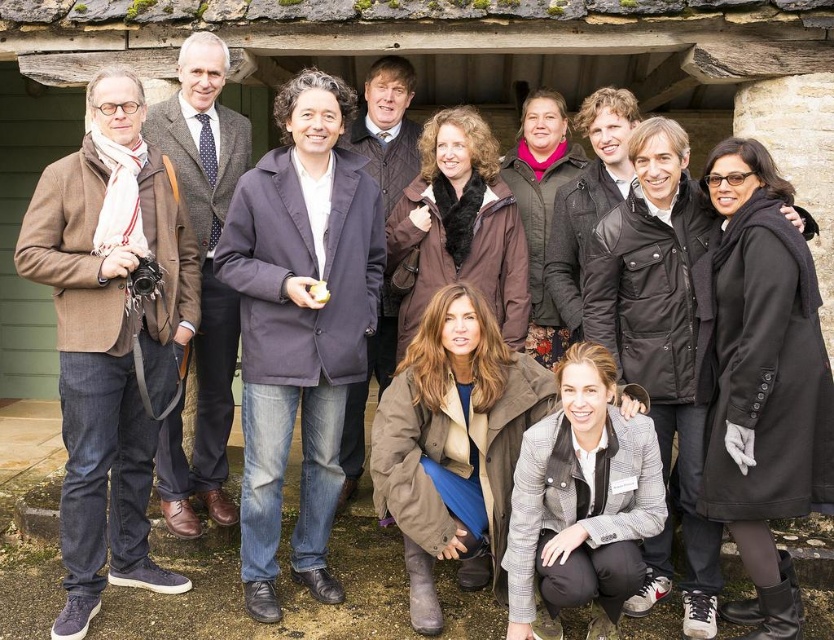
You are a GUI agent. You are given a task and a screenshot of the screen. Output one action in this format:
    pyautogui.click(x=<x>, y=<y>)
    Task: Click on the black wool coat at center-right
    
    Given the screenshot: What is the action you would take?
    pyautogui.click(x=761, y=380)

Is point (731, 429) more distant than point (186, 465)?

No.

Locate an element on the screen. black wool coat at center-right is located at coordinates (761, 380).

Between point (113, 346) and point (295, 193), which one is positioned in front?

Point (113, 346)

Measure the distance between point [143,566] and camera.

A distance of 10.25 meters exists between point [143,566] and camera.

What are the coordinates of `brown woolen jacket at left` in the screenshot? It's located at (109, 337).

Can you confirm if brown woolen jacket at left is thinner than black wool coat at center-right?

No, brown woolen jacket at left is not thinner than black wool coat at center-right.

Describe the element at coordinates (109, 337) in the screenshot. I see `brown woolen jacket at left` at that location.

Find the location of a particular element. brown woolen jacket at left is located at coordinates (109, 337).